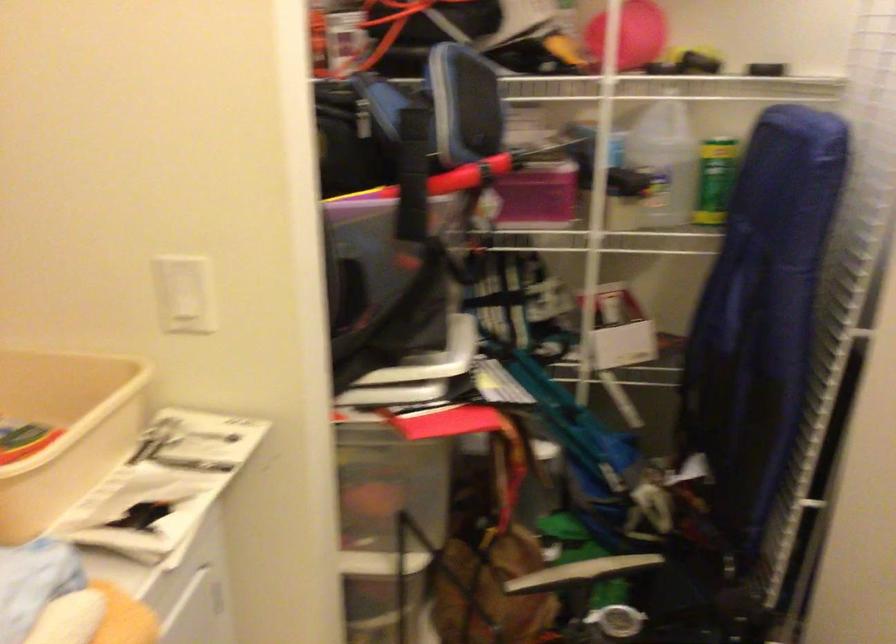
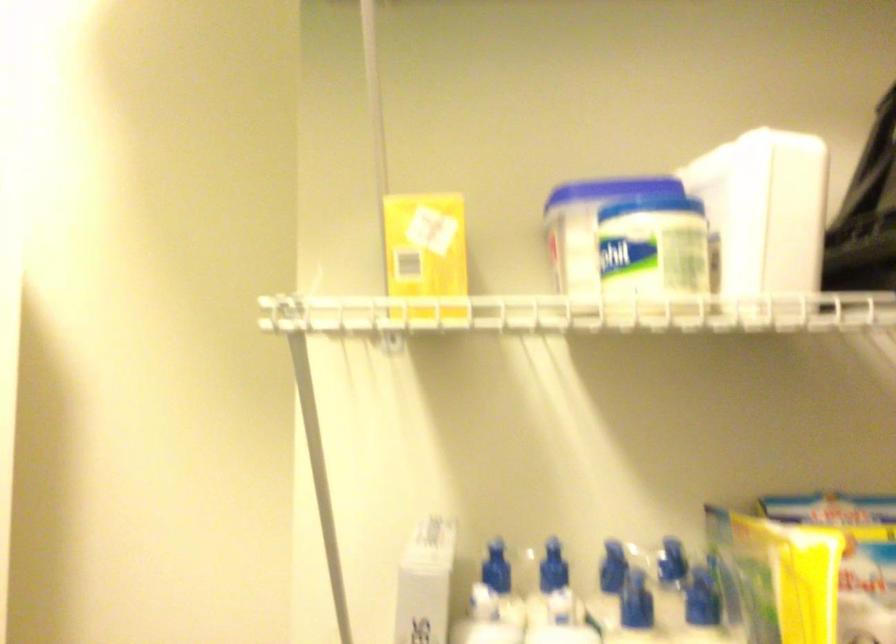
How did the camera likely rotate?

The rotation direction of the camera is right-up.